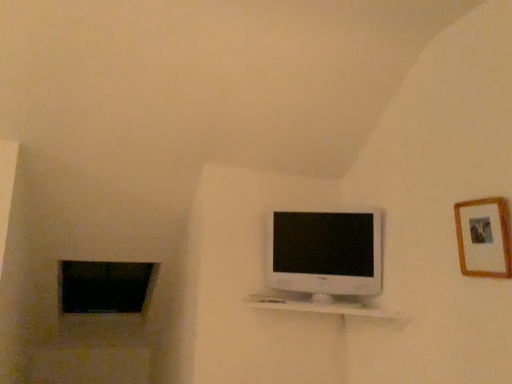
Question: Are black glass window at lower left and white glossy shelf at center making contact?

Choices:
 (A) no
 (B) yes

Answer: (A)

Question: Is black glass window at lower left positioned before white glossy shelf at center?

Choices:
 (A) no
 (B) yes

Answer: (A)

Question: Can you confirm if black glass window at lower left is taller than white glossy shelf at center?

Choices:
 (A) no
 (B) yes

Answer: (B)

Question: Is white glossy shelf at center inside black glass window at lower left?

Choices:
 (A) yes
 (B) no

Answer: (B)

Question: Considering the relative positions of black glass window at lower left and white glossy shelf at center in the image provided, is black glass window at lower left to the right of white glossy shelf at center from the viewer's perspective?

Choices:
 (A) no
 (B) yes

Answer: (A)

Question: From the image's perspective, is white glossy shelf at center positioned above or below white glossy television at center?

Choices:
 (A) below
 (B) above

Answer: (A)

Question: In the image, is white glossy shelf at center on the left side or the right side of white glossy television at center?

Choices:
 (A) left
 (B) right

Answer: (A)

Question: Is white glossy shelf at center wider or thinner than white glossy television at center?

Choices:
 (A) wide
 (B) thin

Answer: (A)

Question: Is white glossy shelf at center taller or shorter than white glossy television at center?

Choices:
 (A) tall
 (B) short

Answer: (B)

Question: From their relative heights in the image, would you say wooden picture frame at upper right is taller or shorter than white glossy shelf at center?

Choices:
 (A) short
 (B) tall

Answer: (B)

Question: From a real-world perspective, relative to white glossy shelf at center, is wooden picture frame at upper right vertically above or below?

Choices:
 (A) below
 (B) above

Answer: (B)

Question: Relative to white glossy shelf at center, is wooden picture frame at upper right in front or behind?

Choices:
 (A) behind
 (B) front

Answer: (B)

Question: In terms of width, does wooden picture frame at upper right look wider or thinner when compared to white glossy shelf at center?

Choices:
 (A) wide
 (B) thin

Answer: (B)

Question: Is white glossy television at center bigger or smaller than white glossy shelf at center?

Choices:
 (A) small
 (B) big

Answer: (B)

Question: From a real-world perspective, relative to white glossy shelf at center, is white glossy television at center vertically above or below?

Choices:
 (A) above
 (B) below

Answer: (A)